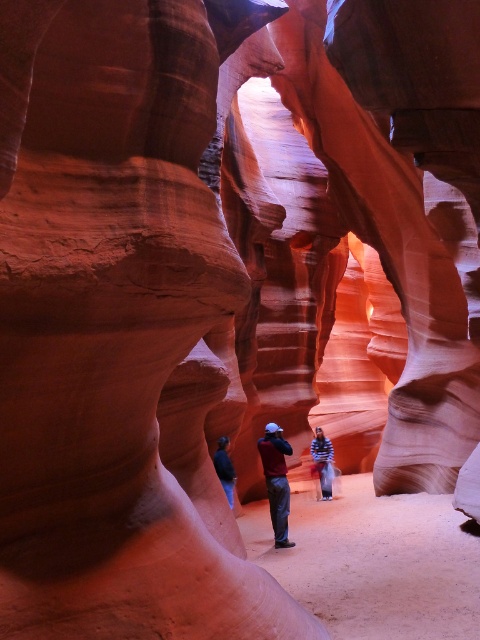
You are a photographer standing in the narrow slot canyon. You notice two shirts hanging from a rock formation at the center of the scene. The shirts are labeled as the maroon fabric shirt at center and the striped shirt at center. Which shirt appears shorter in the image?

The maroon fabric shirt at center appears shorter than the striped shirt at center in the image.

You are standing in the narrow slot canyon and see the maroon fabric shirt at center. If you want to move towards the shirt, which direction should you walk from your current position?

The maroon fabric shirt at center is located at point (276, 481). Since the canyon is narrow, you should walk straight ahead towards the center of the canyon to reach the shirt.

You are standing in the narrow slot canyon and see two shirts at the center of the scene. The maroon fabric shirt at center and the striped shirt at center. You want to pick up the closest one to you. Which shirt should you choose?

The maroon fabric shirt at center is 4.94 meters away from striped shirt at center. Since you want to pick up the closest one, you should choose whichever is nearer to your current position. However, the description only provides the distance between them, not their individual distances from you. Without knowing your exact location relative to both shirts, it is impossible to determine which is closer.